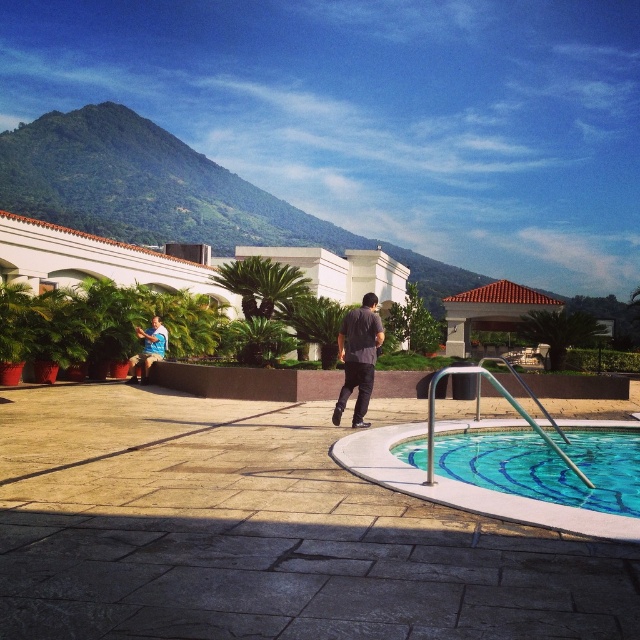
Describe the element at coordinates (144, 186) in the screenshot. The height and width of the screenshot is (640, 640). I see `green leafy mountain at upper left` at that location.

Between green leafy mountain at upper left and matte blue shirt at lower left, which one has less height?

matte blue shirt at lower left

Is point (17, 168) less distant than point (160, 342)?

No, (17, 168) is further to viewer.

At what (x,y) coordinates should I click in order to perform the action: click on green leafy mountain at upper left. Please return your answer as a coordinate pair (x, y). This screenshot has height=640, width=640. Looking at the image, I should click on tap(144, 186).

Between point (621, 467) and point (522, 289), which one is positioned behind?

Positioned behind is point (522, 289).

What do you see at coordinates (547, 465) in the screenshot? This screenshot has width=640, height=640. I see `clear glass pool at lower right` at bounding box center [547, 465].

This screenshot has width=640, height=640. I want to click on clear glass pool at lower right, so click(x=547, y=465).

Between clear glass pool at lower right and matte blue shirt at lower left, which one appears on the right side from the viewer's perspective?

Positioned to the right is clear glass pool at lower right.

Between point (525, 486) and point (156, 346), which one is positioned in front?

Positioned in front is point (525, 486).

This screenshot has width=640, height=640. What do you see at coordinates (547, 465) in the screenshot?
I see `clear glass pool at lower right` at bounding box center [547, 465].

At what (x,y) coordinates should I click in order to perform the action: click on clear glass pool at lower right. Please return your answer as a coordinate pair (x, y). This screenshot has width=640, height=640. Looking at the image, I should click on (547, 465).